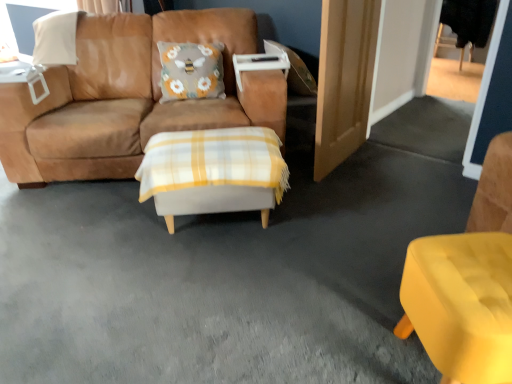
The height and width of the screenshot is (384, 512). I want to click on vacant area that lies to the right of wooden door at right, so click(401, 171).